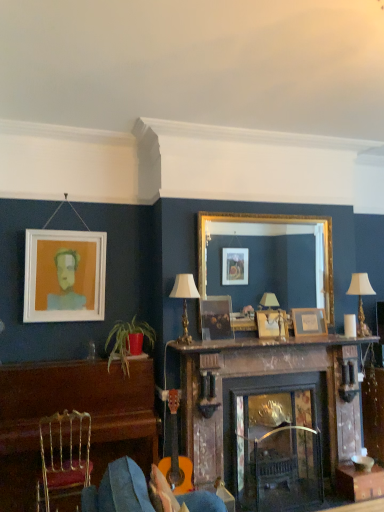
Question: Is green leafy plant in red pot at lower left situated inside rustic wood fireplace at center or outside?

Choices:
 (A) inside
 (B) outside

Answer: (B)

Question: Does point (152, 346) appear closer or farther from the camera than point (253, 490)?

Choices:
 (A) closer
 (B) farther

Answer: (B)

Question: Based on their relative distances, which object is farther from the wooden table at center?

Choices:
 (A) matte white picture frame at left, the first picture frame when ordered from left to right
 (B) white wax candle at center-right
 (C) green leafy plant in red pot at lower left
 (D) wooden picture frame at center, the 3th picture frame viewed from the left
 (E) matte wooden picture frame at center, which is counted as the 2th picture frame, starting from the left

Answer: (A)

Question: Considering the real-world distances, which object is farthest from the white wax candle at center-right?

Choices:
 (A) brown wooden dresser at left
 (B) gold metallic chair at lower left
 (C) wooden frame at upper center, arranged as the first picture frame when viewed from the right
 (D) marble mantelpiece at center
 (E) gold-framed mirror at center

Answer: (B)